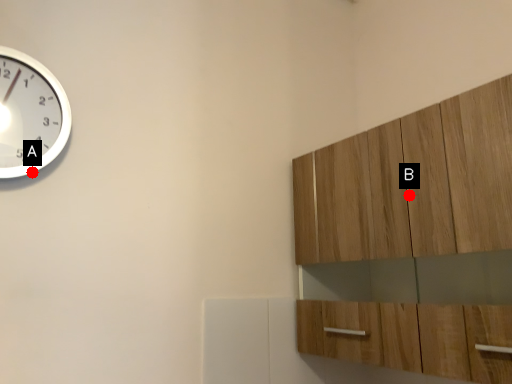
Question: Two points are circled on the image, labeled by A and B beside each circle. Which of the following is the closest to the observer?

Choices:
 (A) A is closer
 (B) B is closer

Answer: (A)